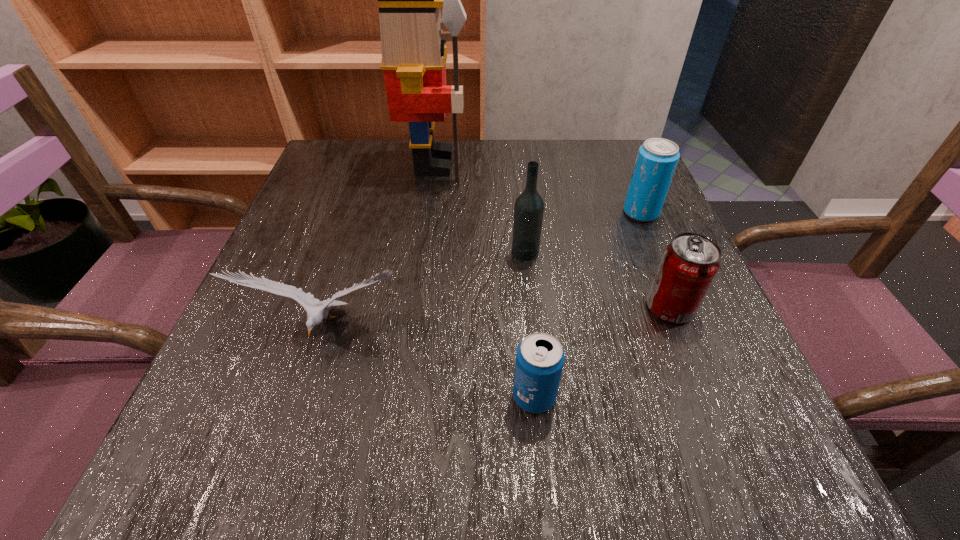
Where is `free location that satisfies the following two spatial constraints: 1. in front of the farthest soda can holding the staff; 2. on the left side of the nutcracker`? The height and width of the screenshot is (540, 960). free location that satisfies the following two spatial constraints: 1. in front of the farthest soda can holding the staff; 2. on the left side of the nutcracker is located at coordinates (427, 212).

At what (x,y) coordinates should I click in order to perform the action: click on free spot that satisfies the following two spatial constraints: 1. in front of the nearest object holding the staff; 2. on the left side of the nutcracker. Please return your answer as a coordinate pair (x, y). Image resolution: width=960 pixels, height=540 pixels. Looking at the image, I should click on (402, 396).

At what (x,y) coordinates should I click in order to perform the action: click on vacant space that satisfies the following two spatial constraints: 1. in front of the second farthest soda can holding the staff; 2. on the left side of the nutcracker. Please return your answer as a coordinate pair (x, y). Looking at the image, I should click on (414, 308).

The height and width of the screenshot is (540, 960). I want to click on free space that satisfies the following two spatial constraints: 1. in front of the tallest object holding the staff; 2. at the tip of the beak of the gull, so click(411, 329).

The width and height of the screenshot is (960, 540). Find the location of `vacant space that satisfies the following two spatial constraints: 1. in front of the second farthest object holding the staff; 2. on the left side of the tallest object`. vacant space that satisfies the following two spatial constraints: 1. in front of the second farthest object holding the staff; 2. on the left side of the tallest object is located at coordinates (427, 212).